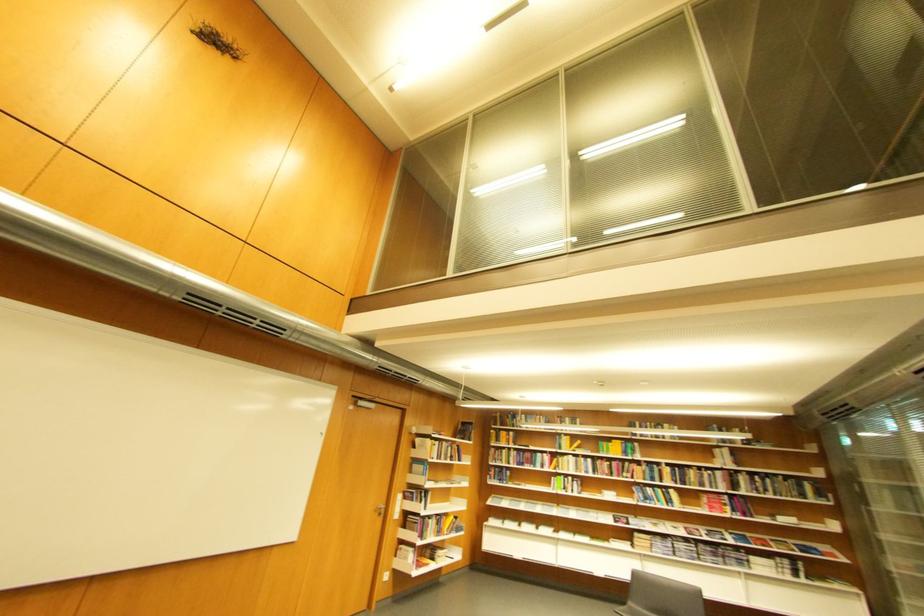
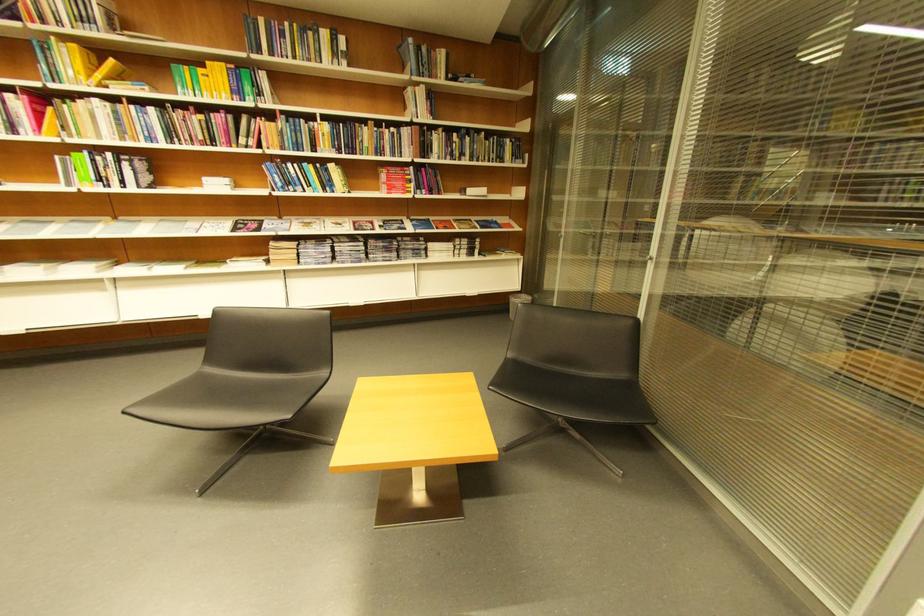
In the second image, find the point that corresponds to (x=638, y=479) in the first image.

(258, 148)